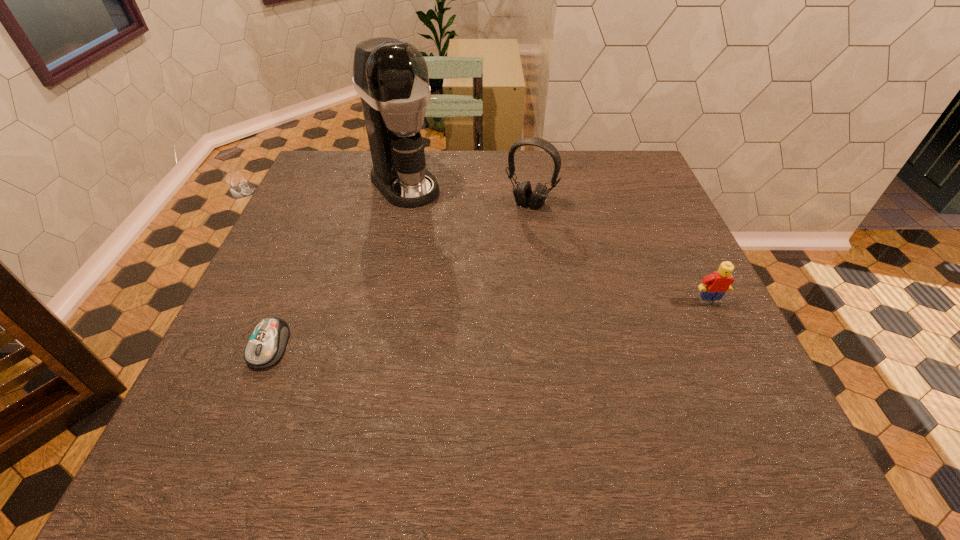
Where is `free region located on the front-facing side of the headset`? The height and width of the screenshot is (540, 960). free region located on the front-facing side of the headset is located at coordinates (508, 234).

Where is `free spot located on the front-facing side of the headset`? free spot located on the front-facing side of the headset is located at coordinates (463, 311).

At what (x,y) coordinates should I click in order to perform the action: click on free location located 0.070m on the front-facing side of the headset. Please return your answer as a coordinate pair (x, y). The width and height of the screenshot is (960, 540). Looking at the image, I should click on (513, 227).

You are a GUI agent. You are given a task and a screenshot of the screen. Output one action in this format:
    pyautogui.click(x=<x>, y=<y>)
    Task: Click on the free spot located place cup under the spout of the coffee maker
    
    Given the screenshot: What is the action you would take?
    pyautogui.click(x=463, y=248)

At what (x,y) coordinates should I click in order to perform the action: click on vacant area located place cup under the spout of the coffee maker. Please return your answer as a coordinate pair (x, y). This screenshot has height=540, width=960. Looking at the image, I should click on (463, 248).

Image resolution: width=960 pixels, height=540 pixels. I want to click on vacant space located place cup under the spout of the coffee maker, so (444, 229).

The image size is (960, 540). Identify the location of object that is positioned at the far edge. (391, 77).

The width and height of the screenshot is (960, 540). I want to click on object situated at the near edge, so click(x=266, y=345).

Identify the location of object present at the left edge. (266, 345).

Where is `object at the right edge`? The height and width of the screenshot is (540, 960). object at the right edge is located at coordinates (714, 286).